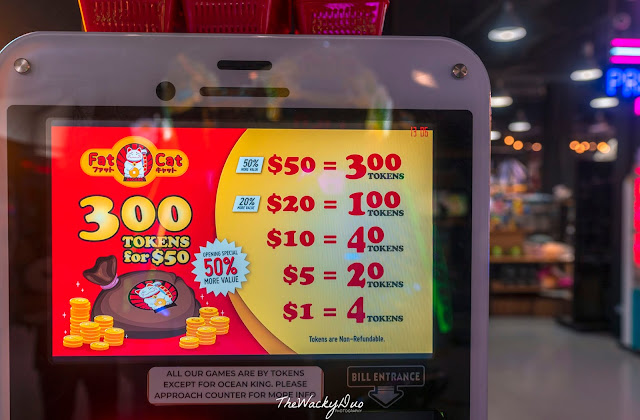
Identify the location of floor. (541, 371).